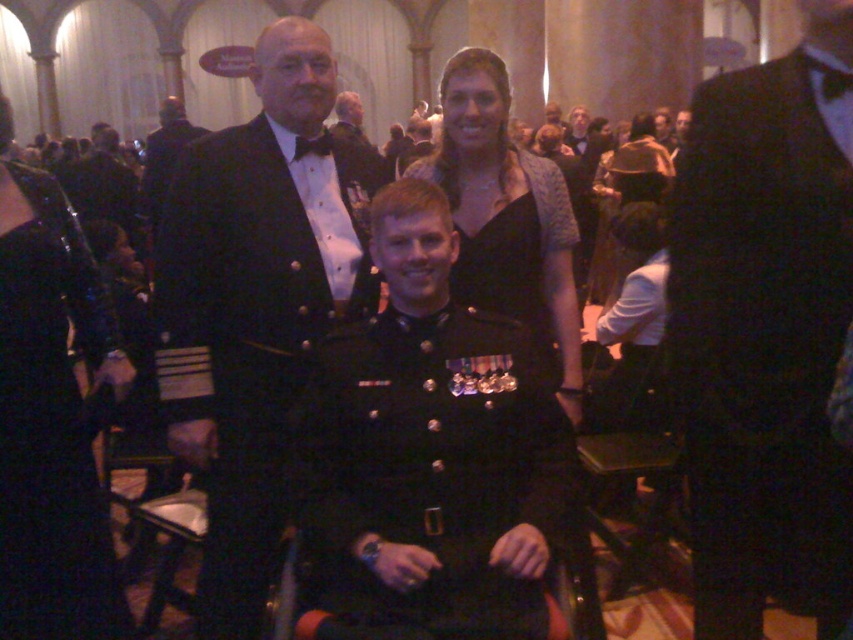
You are a photographer at the event and need to position a spotlight between the black satin suit at center and the shiny black uniform at center. Can you fit the spotlight there if it requires 1.5 meters of space?

The distance between the black satin suit at center and the shiny black uniform at center is 1.35 meters, which is less than the required 1.5 meters. Therefore, the spotlight cannot be placed there.

You are attending the event and want to take a photo with both the shiny black suit at center and the satin black dress at upper center in the same frame. Based on their positions, which object should you position closer to the camera to ensure both fit in the photo?

Since the shiny black suit at center is wider than the satin black dress at upper center, you should position the shiny black suit at center closer to the camera to accommodate its larger width in the photo frame.

You are a photographer at the event and need to capture a group photo of the shiny black suit at center and the older man in a brown suit on the left. The camera you have can focus on subjects within a 4 meter range. Will both subjects be in focus if they stand where they are?

The distance between the shiny black suit at center and the older man in a brown suit on the left is 4.12 meters. Since the camera can only focus within 4 meters, the subjects are slightly out of range and won